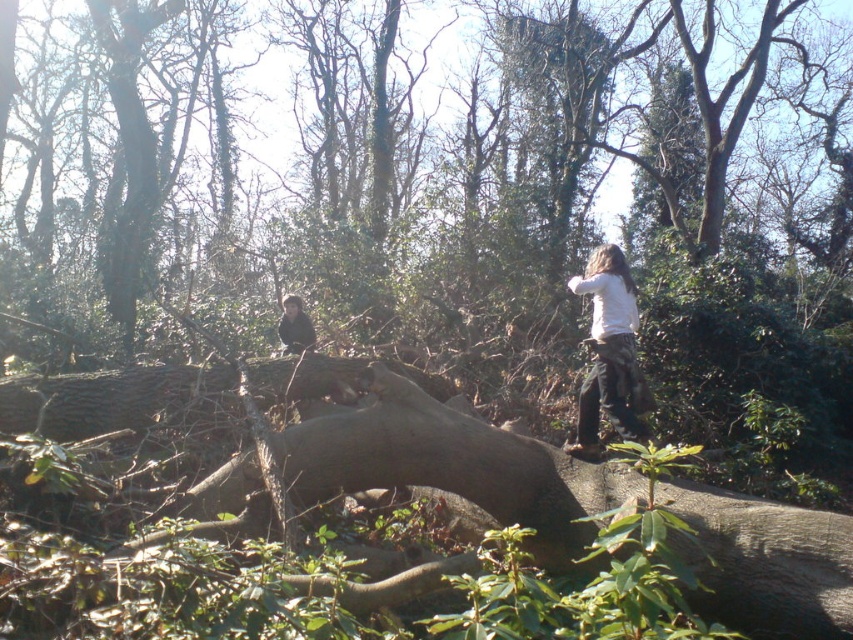
The width and height of the screenshot is (853, 640). I want to click on white cotton shirt at center, so click(x=608, y=355).

Can you confirm if white cotton shirt at center is smaller than dark brown hair at upper center?

No, white cotton shirt at center is not smaller than dark brown hair at upper center.

Is point (601, 324) positioned before point (283, 298)?

Yes.

You are a GUI agent. You are given a task and a screenshot of the screen. Output one action in this format:
    pyautogui.click(x=<x>, y=<y>)
    Task: Click on the white cotton shirt at center
    The image size is (853, 640).
    Given the screenshot: What is the action you would take?
    click(x=608, y=355)

Looking at this image, can you confirm if brown rough tree trunk at center is taller than white cotton shirt at center?

No, brown rough tree trunk at center is not taller than white cotton shirt at center.

Who is more distant from viewer, [786,532] or [599,317]?

The point [599,317] is behind.

This screenshot has height=640, width=853. I want to click on brown rough tree trunk at center, so click(436, 456).

Does point (109, 428) come in front of point (285, 305)?

Yes, it is in front of point (285, 305).

Is brown rough tree trunk at center wider than dark brown hair at upper center?

Yes, brown rough tree trunk at center is wider than dark brown hair at upper center.

You are a GUI agent. You are given a task and a screenshot of the screen. Output one action in this format:
    pyautogui.click(x=<x>, y=<y>)
    Task: Click on the brown rough tree trunk at center
    The image size is (853, 640).
    Given the screenshot: What is the action you would take?
    pyautogui.click(x=436, y=456)

This screenshot has width=853, height=640. In order to click on brown rough tree trunk at center in this screenshot , I will do tap(436, 456).